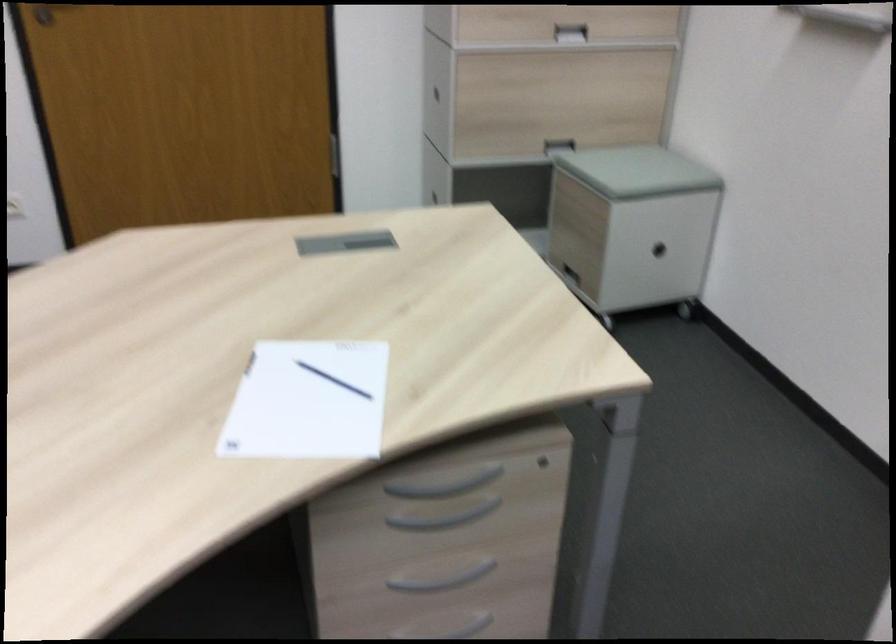
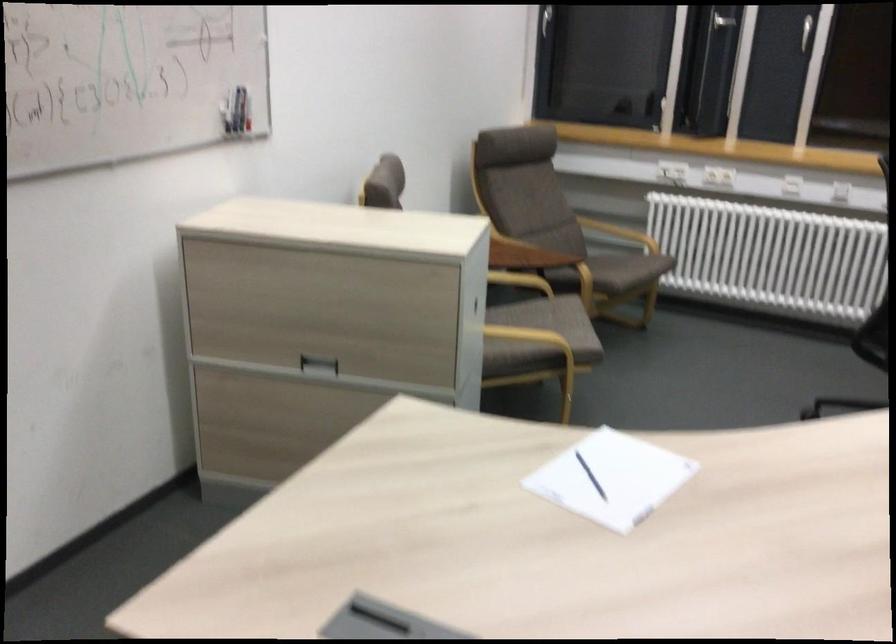
Where in the second image is the point corresponding to point 330,404 from the first image?

(590, 476)